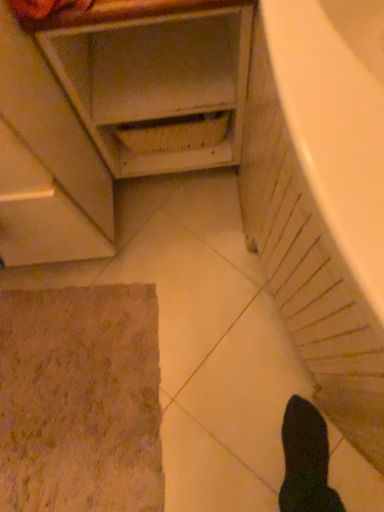
Question: Does point click(54, 422) appear closer or farther from the camera than point click(140, 138)?

Choices:
 (A) closer
 (B) farther

Answer: (B)

Question: Is brown textured bath mat at lower left wider or thinner than matte white cabinet at upper left?

Choices:
 (A) wide
 (B) thin

Answer: (B)

Question: Which object is the closest to the brown textured bath mat at lower left?

Choices:
 (A) matte white cabinet at upper left
 (B) white glossy bathtub at lower right

Answer: (A)

Question: Which of these objects is positioned closest to the matte white cabinet at upper left?

Choices:
 (A) white glossy bathtub at lower right
 (B) brown textured bath mat at lower left

Answer: (A)